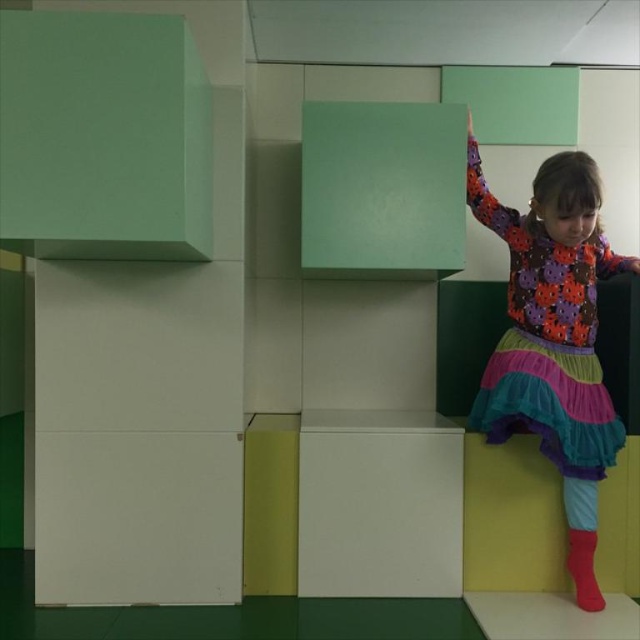
You are a photographer setting up a shoot in this play area. You want to ensure that the multicolored fabric dress at right and the red matte sock at lower right are both visible in the frame. Based on their positions, which object is closer to the camera?

The multicolored fabric dress at right is positioned over the red matte sock at lower right, so the dress is closer to the camera.